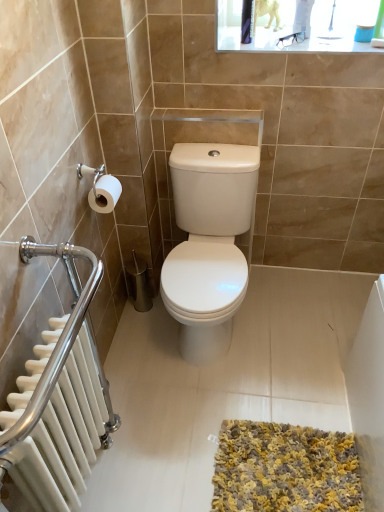
Question: Can you confirm if yellow-grey shaggy bath mat at lower center is thinner than white matte toilet paper at left?

Choices:
 (A) no
 (B) yes

Answer: (A)

Question: Does yellow-grey shaggy bath mat at lower center appear on the right side of white matte toilet paper at left?

Choices:
 (A) yes
 (B) no

Answer: (A)

Question: Is yellow-grey shaggy bath mat at lower center facing towards white matte toilet paper at left?

Choices:
 (A) no
 (B) yes

Answer: (A)

Question: Is yellow-grey shaggy bath mat at lower center wider than white matte toilet paper at left?

Choices:
 (A) yes
 (B) no

Answer: (A)

Question: Is yellow-grey shaggy bath mat at lower center smaller than white matte toilet paper at left?

Choices:
 (A) yes
 (B) no

Answer: (B)

Question: Is the position of yellow-grey shaggy bath mat at lower center more distant than that of white matte toilet paper at left?

Choices:
 (A) no
 (B) yes

Answer: (A)

Question: From a real-world perspective, is white matte toilet paper at left over white metallic radiator at left?

Choices:
 (A) yes
 (B) no

Answer: (A)

Question: Considering the relative sizes of white matte toilet paper at left and white metallic radiator at left in the image provided, is white matte toilet paper at left taller than white metallic radiator at left?

Choices:
 (A) no
 (B) yes

Answer: (A)

Question: Does white matte toilet paper at left have a greater width compared to white metallic radiator at left?

Choices:
 (A) no
 (B) yes

Answer: (A)

Question: From a real-world perspective, is white matte toilet paper at left under white metallic radiator at left?

Choices:
 (A) no
 (B) yes

Answer: (A)

Question: Does white matte toilet paper at left come behind white metallic radiator at left?

Choices:
 (A) no
 (B) yes

Answer: (B)

Question: Is white matte toilet paper at left at the right side of white metallic radiator at left?

Choices:
 (A) no
 (B) yes

Answer: (B)

Question: Is white matte toilet paper at left at the right side of yellow-grey shaggy bath mat at lower center?

Choices:
 (A) no
 (B) yes

Answer: (A)